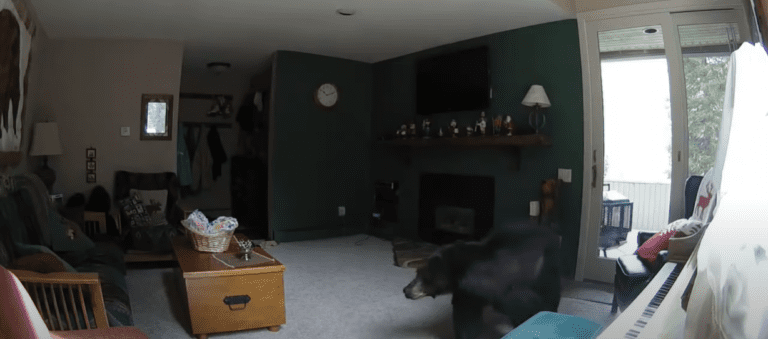
At what (x,y) coordinates should I click in order to perform the action: click on mirror. Please return your answer as a coordinate pair (x, y). This screenshot has width=768, height=339. Looking at the image, I should click on (157, 117).